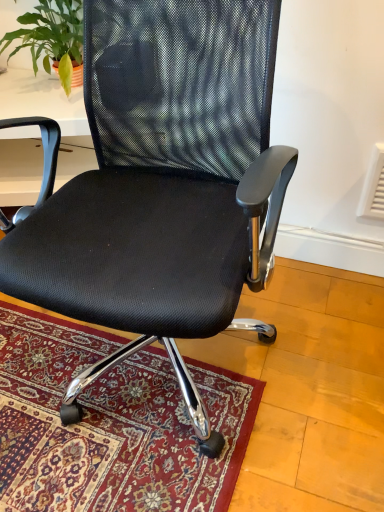
Question: Is green leafy plant at upper left inside the boundaries of black mesh office chair at center, or outside?

Choices:
 (A) outside
 (B) inside

Answer: (A)

Question: From the image's perspective, is green leafy plant at upper left located above or below black mesh office chair at center?

Choices:
 (A) below
 (B) above

Answer: (B)

Question: Based on their sizes in the image, would you say green leafy plant at upper left is bigger or smaller than black mesh office chair at center?

Choices:
 (A) big
 (B) small

Answer: (B)

Question: Is black mesh office chair at center taller or shorter than green leafy plant at upper left?

Choices:
 (A) tall
 (B) short

Answer: (A)

Question: Based on their positions, is black mesh office chair at center located to the left or right of green leafy plant at upper left?

Choices:
 (A) right
 (B) left

Answer: (A)

Question: From a real-world perspective, is black mesh office chair at center physically located above or below green leafy plant at upper left?

Choices:
 (A) above
 (B) below

Answer: (B)

Question: From the image's perspective, is black mesh office chair at center above or below green leafy plant at upper left?

Choices:
 (A) above
 (B) below

Answer: (B)